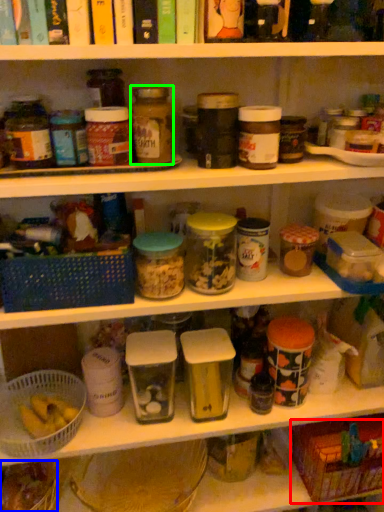
Question: Which object is the closest to the basket (highlighted by a red box)? Choose among these: food (highlighted by a blue box) or bottle (highlighted by a green box).

Choices:
 (A) food
 (B) bottle

Answer: (A)